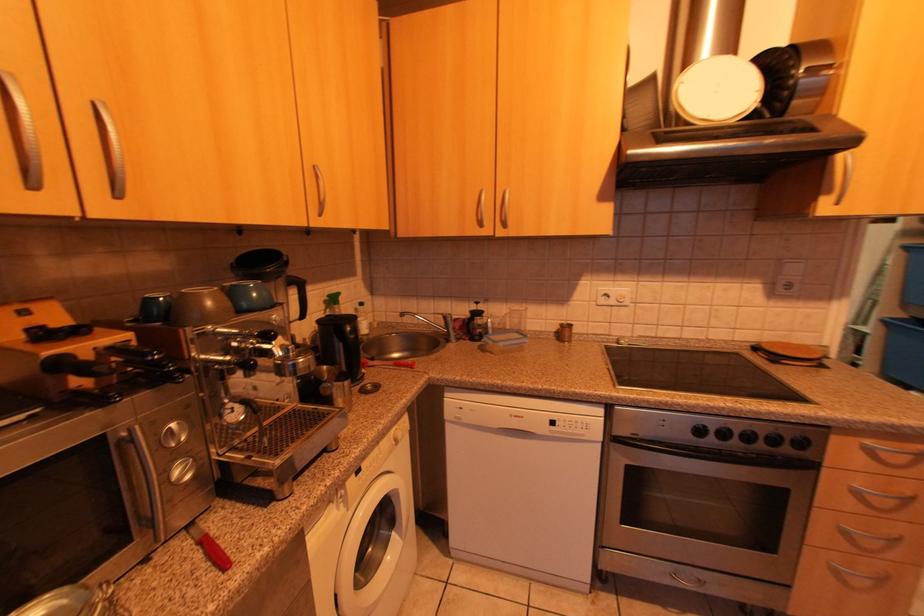
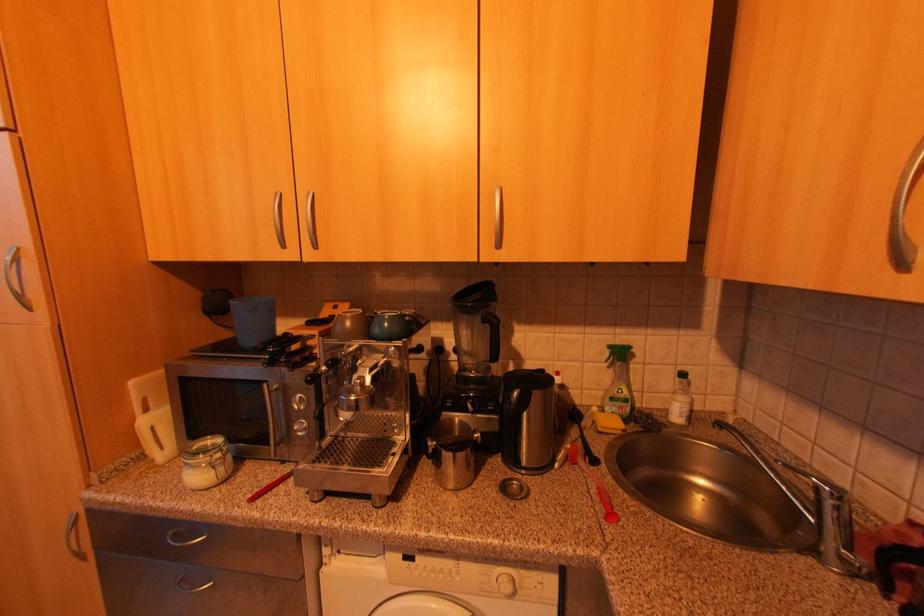
Question: The camera is either moving clockwise (left) or counter-clockwise (right) around the object. The first image is from the beginning of the video and the second image is from the end. Is the camera moving left or right when shooting the video?

Choices:
 (A) Left
 (B) Right

Answer: (B)